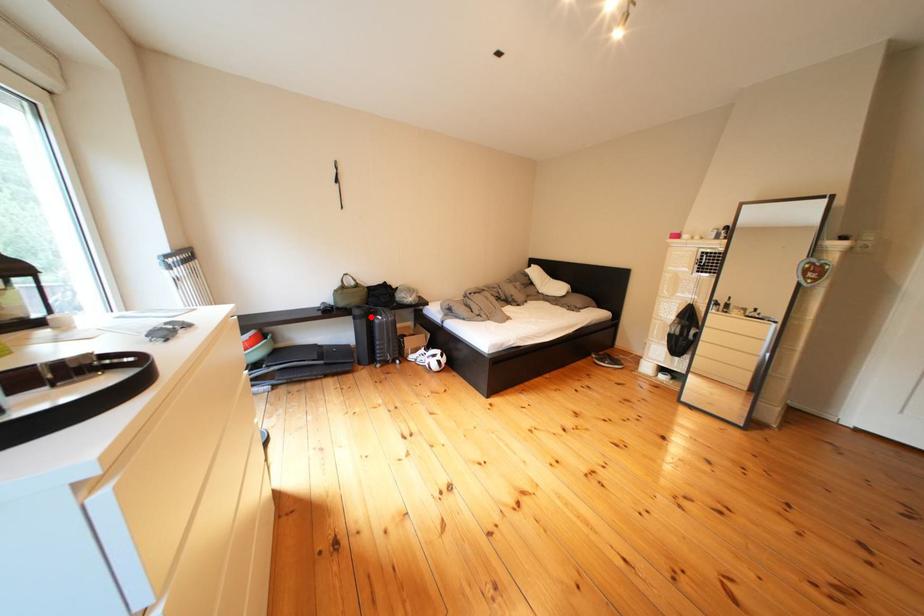
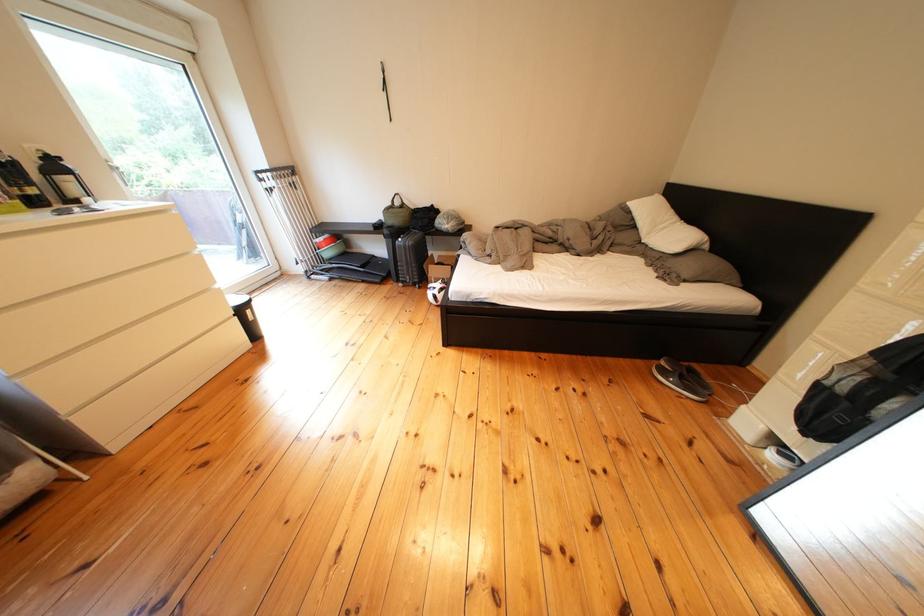
The point at the highlighted location is marked in the first image. Where is the corresponding point in the second image?

(399, 236)